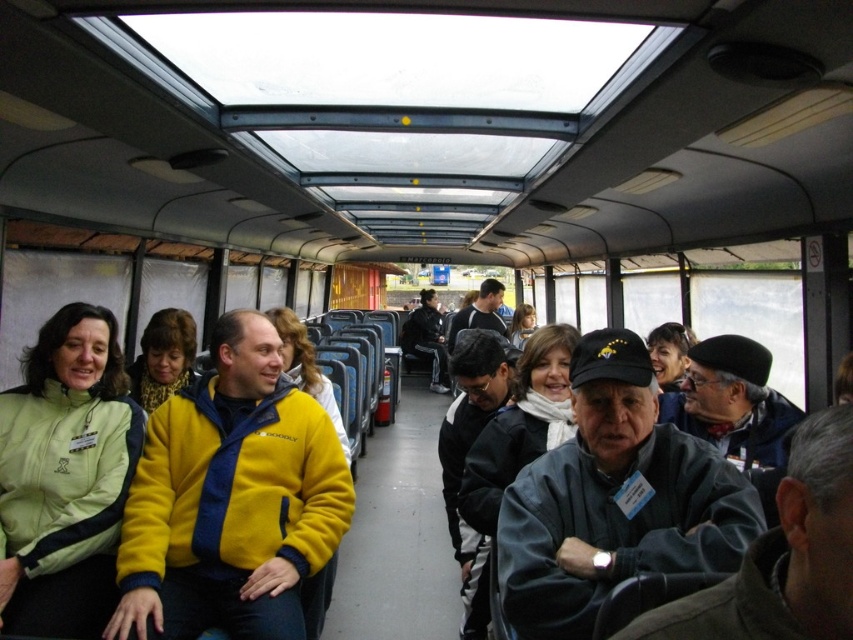
Which is more to the right, yellow fleece jacket at center or light green fleece jacket at left?

yellow fleece jacket at center

The width and height of the screenshot is (853, 640). What do you see at coordinates (230, 499) in the screenshot?
I see `yellow fleece jacket at center` at bounding box center [230, 499].

Is point (170, 472) farther from viewer compared to point (33, 618)?

Yes, it is.

Image resolution: width=853 pixels, height=640 pixels. What are the coordinates of `yellow fleece jacket at center` in the screenshot? It's located at [230, 499].